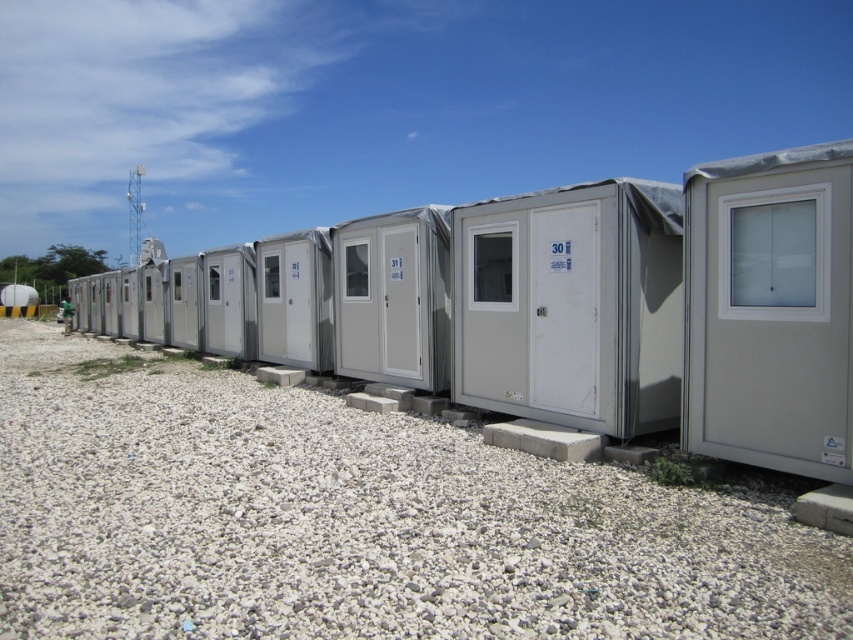
Question: Can you confirm if white gravel at lower center is wider than matte gray container at center?

Choices:
 (A) yes
 (B) no

Answer: (A)

Question: Does white gravel at lower center appear under matte gray container at center?

Choices:
 (A) no
 (B) yes

Answer: (B)

Question: Which point is closer to the camera?

Choices:
 (A) matte gray container at center
 (B) white gravel at lower center

Answer: (B)

Question: Among these points, which one is farthest from the camera?

Choices:
 (A) (531, 385)
 (B) (505, 554)

Answer: (A)

Question: Is the position of white gravel at lower center more distant than that of matte gray container at center?

Choices:
 (A) yes
 (B) no

Answer: (B)